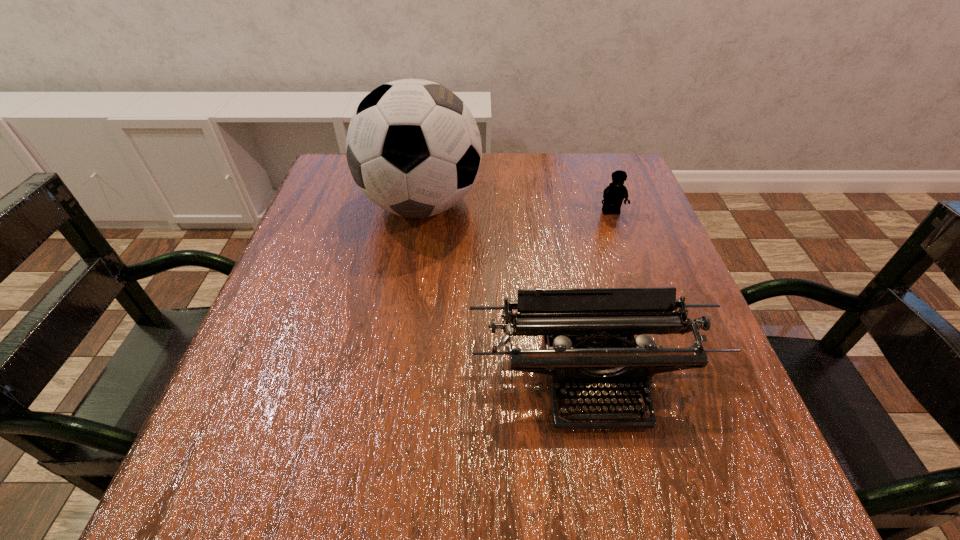
Find the location of a particular element. This screenshot has height=540, width=960. Lego present at the right edge is located at coordinates (614, 194).

Locate an element on the screen. This screenshot has width=960, height=540. object that is at the far left corner is located at coordinates (413, 147).

Where is `free space at the far edge`? free space at the far edge is located at coordinates (504, 167).

You are a GUI agent. You are given a task and a screenshot of the screen. Output one action in this format:
    pyautogui.click(x=<x>, y=<y>)
    Task: Click on the vacant space at the near edge of the desktop
    The image size is (960, 540).
    Given the screenshot: What is the action you would take?
    pyautogui.click(x=370, y=463)

The width and height of the screenshot is (960, 540). I want to click on free space at the left edge, so (241, 407).

Identify the location of vacant point at the right edge. This screenshot has height=540, width=960. (658, 252).

The height and width of the screenshot is (540, 960). Find the location of `free region at the near left corner of the desktop`. free region at the near left corner of the desktop is located at coordinates (300, 509).

You are a GUI agent. You are given a task and a screenshot of the screen. Output one action in this format:
    pyautogui.click(x=<x>, y=<y>)
    Task: Click on the vacant space at the far right corner of the desktop
    The width and height of the screenshot is (960, 540).
    Given the screenshot: What is the action you would take?
    pyautogui.click(x=586, y=179)

Find the location of a particular element. The image size is (960, 540). vacant region between the nearest object and the tallest object is located at coordinates (507, 293).

The image size is (960, 540). What are the coordinates of `free space between the shortest object and the soccer ball` in the screenshot? It's located at (516, 209).